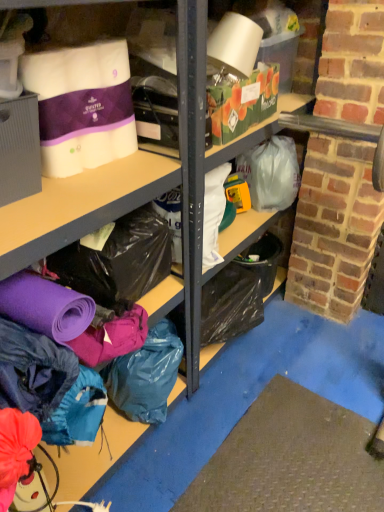
What do you see at coordinates (82, 105) in the screenshot? I see `white quilted paper towels at upper left` at bounding box center [82, 105].

You are a GUI agent. You are given a task and a screenshot of the screen. Output one action in this format:
    pyautogui.click(x=<x>, y=<y>)
    Task: Click on the white quilted paper towels at upper left
    Image resolution: width=384 pixels, height=512 pixels.
    Given the screenshot: What is the action you would take?
    pyautogui.click(x=82, y=105)

Measure the distance between point (46, 67) and camera.

Point (46, 67) and camera are 38.54 inches apart.

What are the coordinates of `white quilted paper towels at upper left` in the screenshot? It's located at (82, 105).